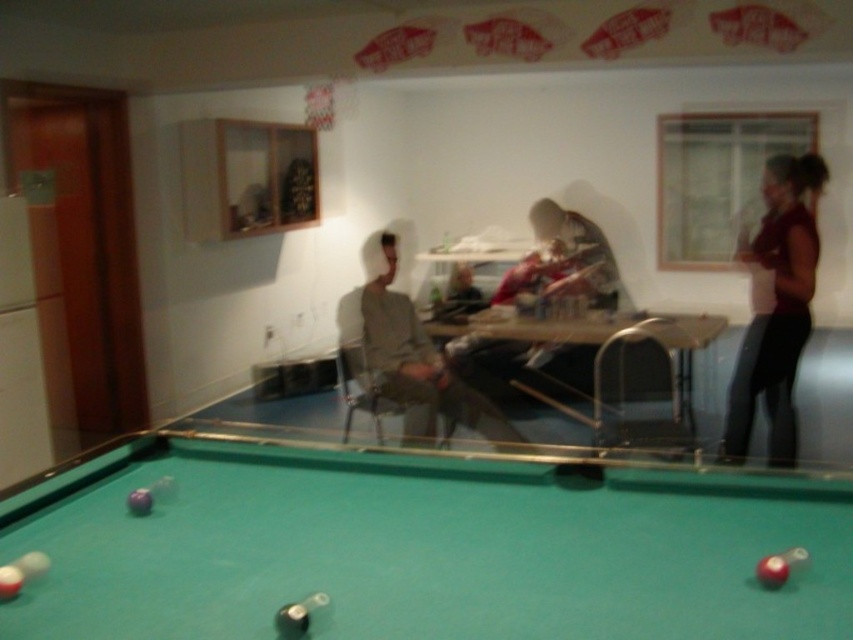
You are standing in the recreational room and want to place a large decorative item between the green felt billiard table at lower center and the dark red fabric at right. Is there enough space between them for the item?

The green felt billiard table at lower center is to the left of the dark red fabric at right, so there is space between them for the item.

You are standing at the entrance of the room and want to approach the green felt billiard table at lower center. According to the coordinates provided, in which direction should you move from your current position to reach it?

The green felt billiard table at lower center is located at coordinates point (421, 547). Since the coordinate system typically places (0, 0) at the bottom left corner, moving towards the right and slightly upwards would lead you to the table.